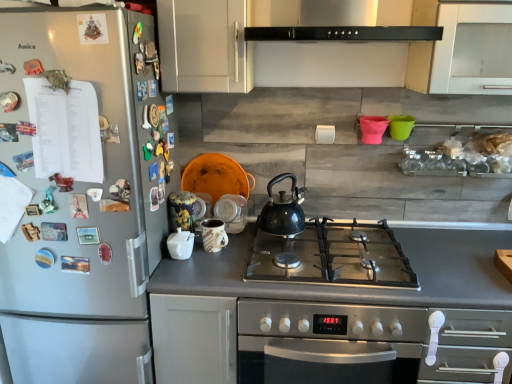
Where is `vacant space to the right of white glossy sugar bowl at center, marked as the first appliance in a front-to-back arrangement`? This screenshot has width=512, height=384. vacant space to the right of white glossy sugar bowl at center, marked as the first appliance in a front-to-back arrangement is located at coordinates (219, 264).